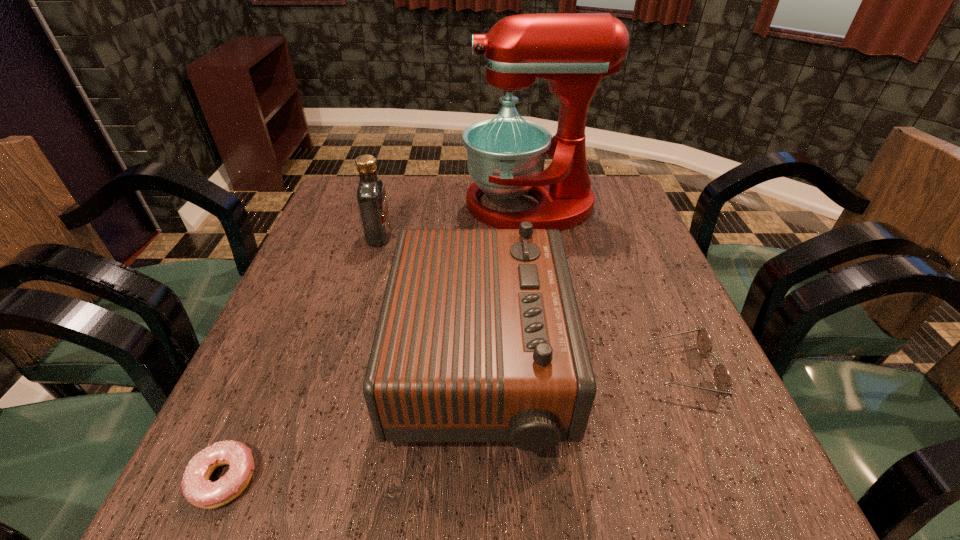
Where is `vacant area located 0.050m on the front panel of the radio receiver`? This screenshot has width=960, height=540. vacant area located 0.050m on the front panel of the radio receiver is located at coordinates (591, 367).

I want to click on free space located on the front-facing side of the spectacles, so click(x=597, y=371).

The height and width of the screenshot is (540, 960). Identify the location of free space located 0.240m on the front-facing side of the spectacles. (521, 371).

I want to click on free spot located 0.200m on the front-facing side of the spectacles, so click(542, 371).

Find the location of a particular element. free space located 0.050m on the back of the doughnut is located at coordinates (250, 419).

Locate an element on the screen. Image resolution: width=960 pixels, height=540 pixels. object that is at the far edge is located at coordinates (572, 51).

Locate an element on the screen. radio receiver present at the near edge is located at coordinates (479, 338).

At what (x,y) coordinates should I click in order to perform the action: click on doughnut positioned at the near edge. Please return your answer as a coordinate pair (x, y). This screenshot has height=540, width=960. Looking at the image, I should click on (197, 488).

At what (x,y) coordinates should I click in order to perform the action: click on vodka positioned at the left edge. Please return your answer as a coordinate pair (x, y). The height and width of the screenshot is (540, 960). Looking at the image, I should click on (371, 194).

Identify the location of doughnut at the left edge. This screenshot has height=540, width=960. (197, 488).